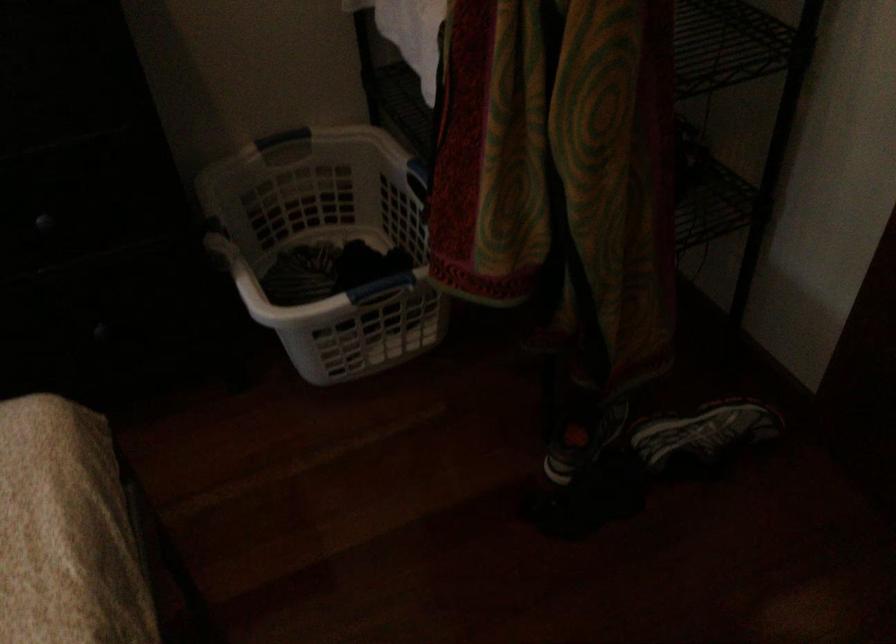
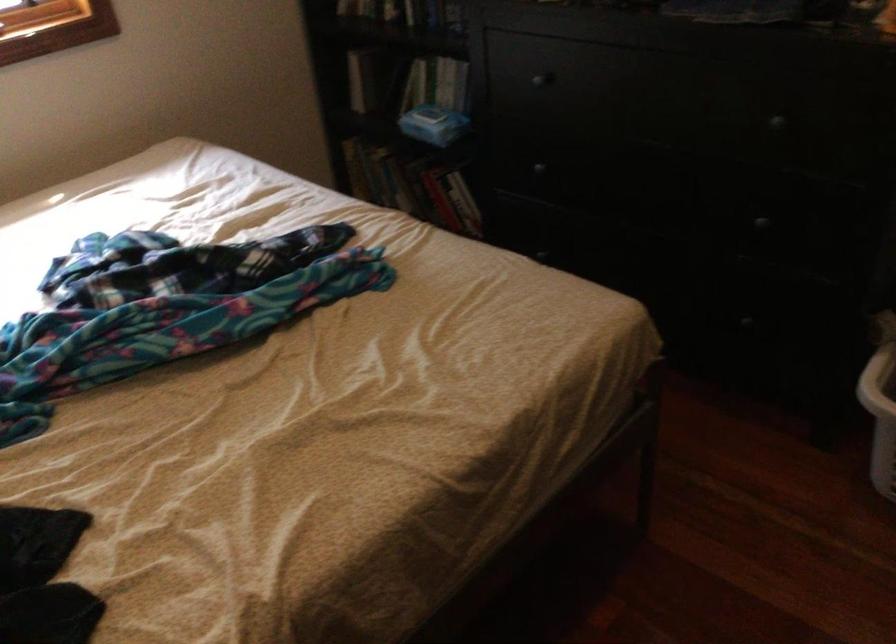
Question: The camera is either moving clockwise (left) or counter-clockwise (right) around the object. The first image is from the beginning of the video and the second image is from the end. Is the camera moving left or right when shooting the video?

Choices:
 (A) Left
 (B) Right

Answer: (B)